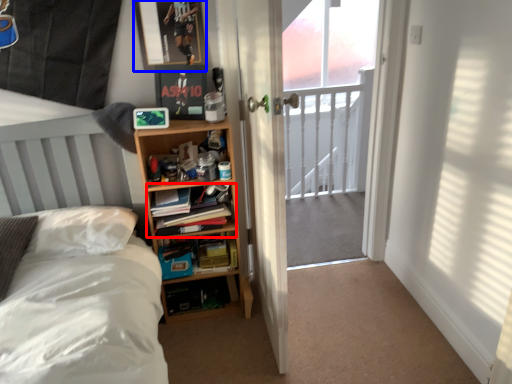
Question: Among these objects, which one is farthest to the camera, book (highlighted by a red box) or picture frame (highlighted by a blue box)?

Choices:
 (A) book
 (B) picture frame

Answer: (A)